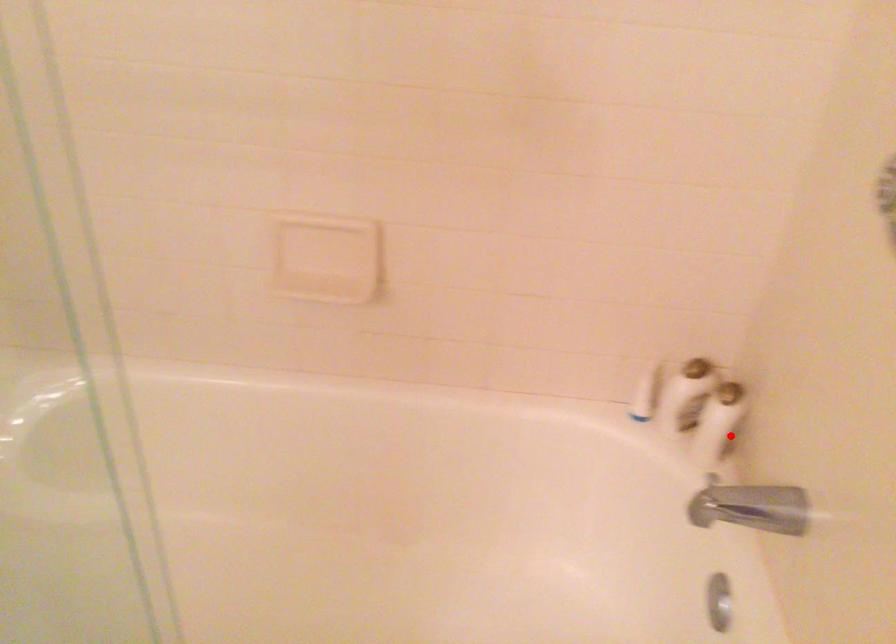
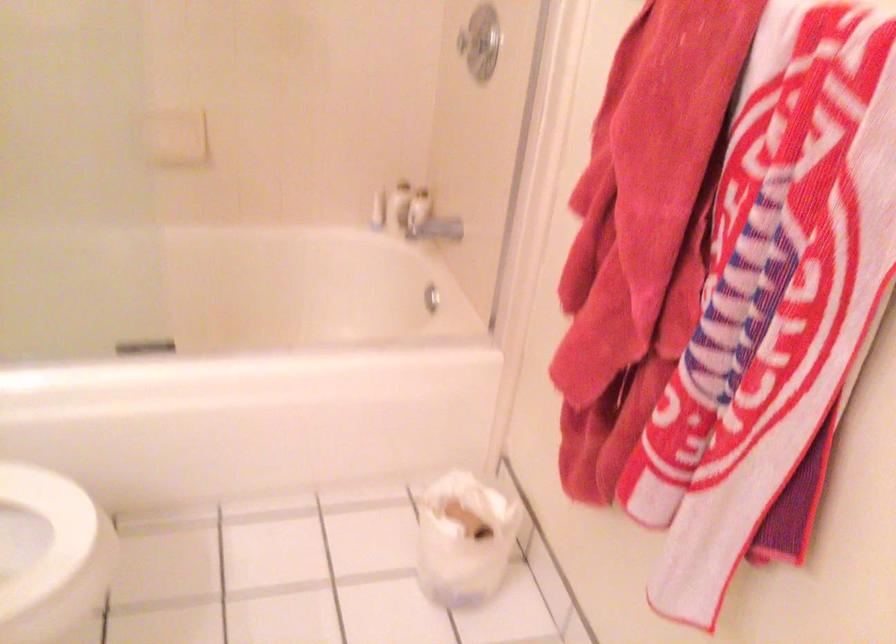
The point at the highlighted location is marked in the first image. Where is the corresponding point in the second image?

(429, 221)